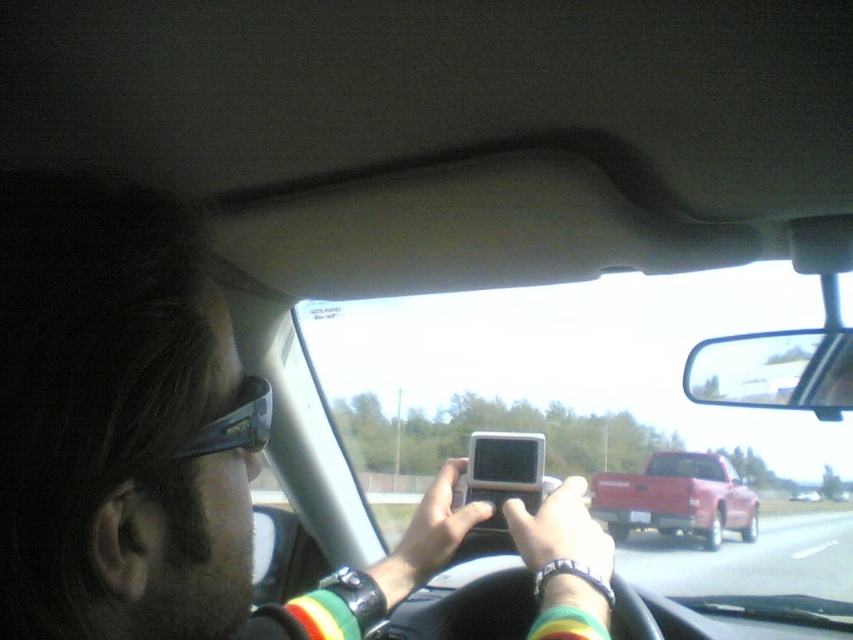
Question: From the image, what is the correct spatial relationship of matte plastic phone at center in relation to metallic red truck at center-right?

Choices:
 (A) right
 (B) left

Answer: (B)

Question: In this image, where is matte gray phone at center located relative to metallic red truck at center-right?

Choices:
 (A) left
 (B) right

Answer: (A)

Question: Estimate the real-world distances between objects in this image. Which object is farther from the matte gray phone at center?

Choices:
 (A) metallic red truck at center
 (B) matte black phone at center
 (C) matte plastic phone at center

Answer: (A)

Question: Is matte gray phone at center closer to camera compared to metallic red truck at center-right?

Choices:
 (A) no
 (B) yes

Answer: (B)

Question: Which point is farther to the camera?

Choices:
 (A) (795, 500)
 (B) (674, 481)
 (C) (480, 440)

Answer: (A)

Question: Which of these objects is positioned farthest from the matte gray phone at center?

Choices:
 (A) metallic red truck at center-right
 (B) matte plastic phone at center
 (C) metallic red truck at center
 (D) matte black phone at center

Answer: (A)